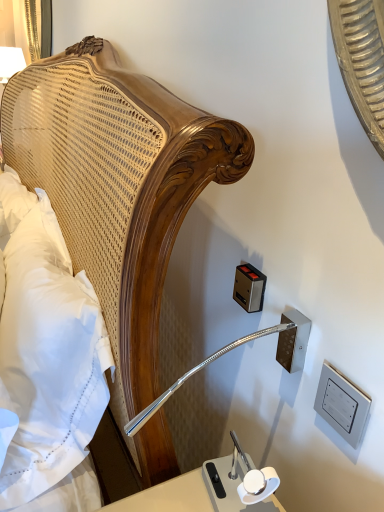
Question: Is metallic rectangular outlet at upper right, arranged as the 1th electric outlet when viewed from the left, thinner than white soft pillow at left?

Choices:
 (A) no
 (B) yes

Answer: (B)

Question: Considering the relative sizes of metallic rectangular outlet at upper right, which ranks as the 2th electric outlet in right-to-left order, and white soft pillow at left in the image provided, is metallic rectangular outlet at upper right, which ranks as the 2th electric outlet in right-to-left order, bigger than white soft pillow at left?

Choices:
 (A) no
 (B) yes

Answer: (A)

Question: Is metallic rectangular outlet at upper right, arranged as the 1th electric outlet when viewed from the left, positioned beyond the bounds of white soft pillow at left?

Choices:
 (A) no
 (B) yes

Answer: (B)

Question: Does metallic rectangular outlet at upper right, the 1th electric outlet in the back-to-front sequence, come behind white soft pillow at left?

Choices:
 (A) no
 (B) yes

Answer: (B)

Question: Is metallic rectangular outlet at upper right, which ranks as the 2th electric outlet in right-to-left order, bigger or smaller than white soft pillow at left?

Choices:
 (A) small
 (B) big

Answer: (A)

Question: Is metallic rectangular outlet at upper right, arranged as the 1th electric outlet when viewed from the left, to the left or to the right of white soft pillow at left in the image?

Choices:
 (A) left
 (B) right

Answer: (B)

Question: From the image's perspective, is metallic rectangular outlet at upper right, which ranks as the 2th electric outlet in right-to-left order, located above or below white soft pillow at left?

Choices:
 (A) above
 (B) below

Answer: (A)

Question: Considering the positions of point (246, 281) and point (56, 220), is point (246, 281) closer or farther from the camera than point (56, 220)?

Choices:
 (A) closer
 (B) farther

Answer: (A)

Question: From a real-world perspective, is metallic silver outlet at lower right, which is the second electric outlet in left-to-right order, physically located above or below white soft pillow at left?

Choices:
 (A) above
 (B) below

Answer: (A)

Question: Looking at their shapes, would you say metallic silver outlet at lower right, which is the second electric outlet in left-to-right order, is wider or thinner than white soft pillow at left?

Choices:
 (A) thin
 (B) wide

Answer: (A)

Question: Is point (286, 339) positioned closer to the camera than point (51, 256)?

Choices:
 (A) farther
 (B) closer

Answer: (B)

Question: Considering their positions, is metallic silver outlet at lower right, positioned as the first electric outlet in right-to-left order, located in front of or behind white soft pillow at left?

Choices:
 (A) behind
 (B) front

Answer: (A)

Question: From the image's perspective, relative to metallic rectangular outlet at upper right, arranged as the 1th electric outlet when viewed from the left, is white soft pillow at left above or below?

Choices:
 (A) above
 (B) below

Answer: (B)

Question: Considering the positions of white soft pillow at left and metallic rectangular outlet at upper right, the 1th electric outlet in the back-to-front sequence, in the image, is white soft pillow at left taller or shorter than metallic rectangular outlet at upper right, the 1th electric outlet in the back-to-front sequence,?

Choices:
 (A) tall
 (B) short

Answer: (A)